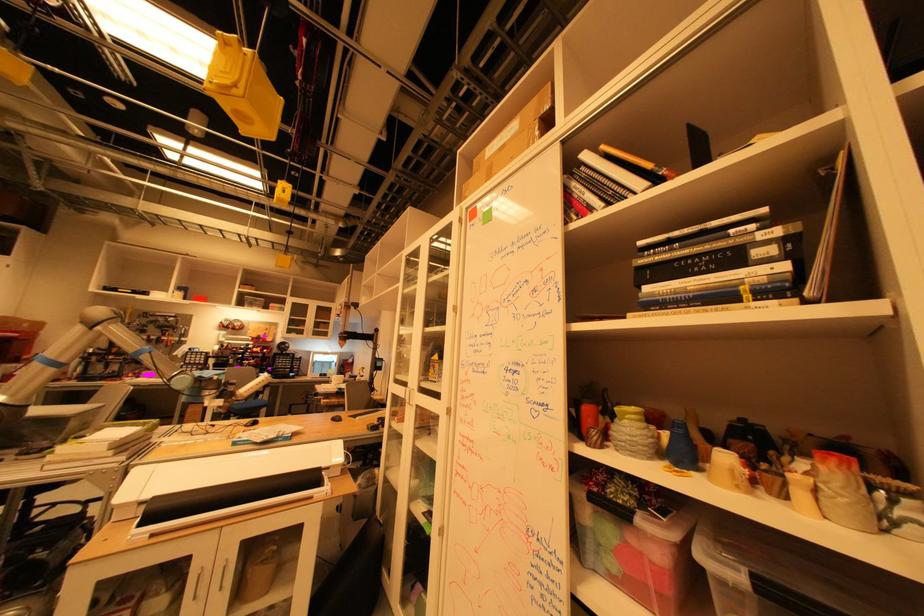
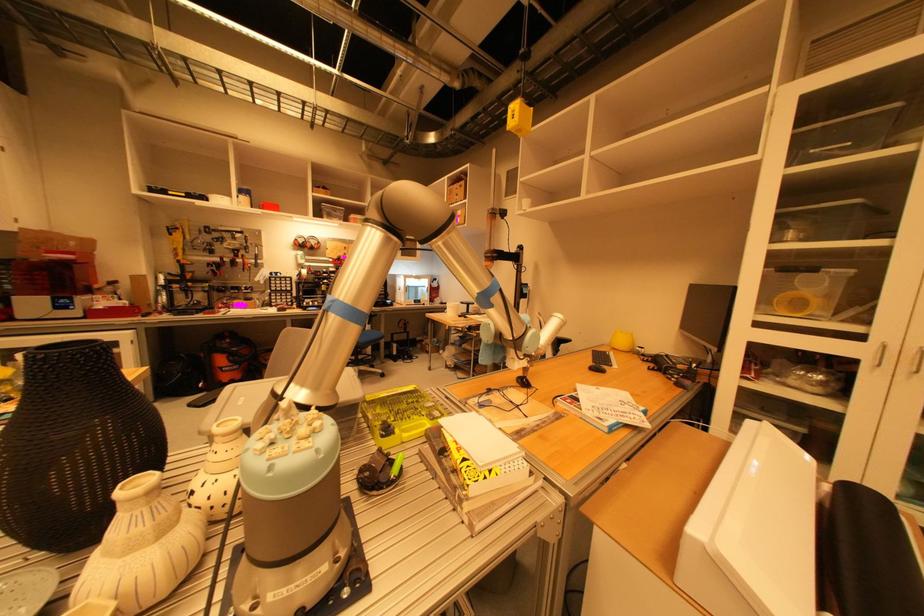
In the second image, find the point that corresponds to (x=176, y=336) in the first image.

(249, 257)